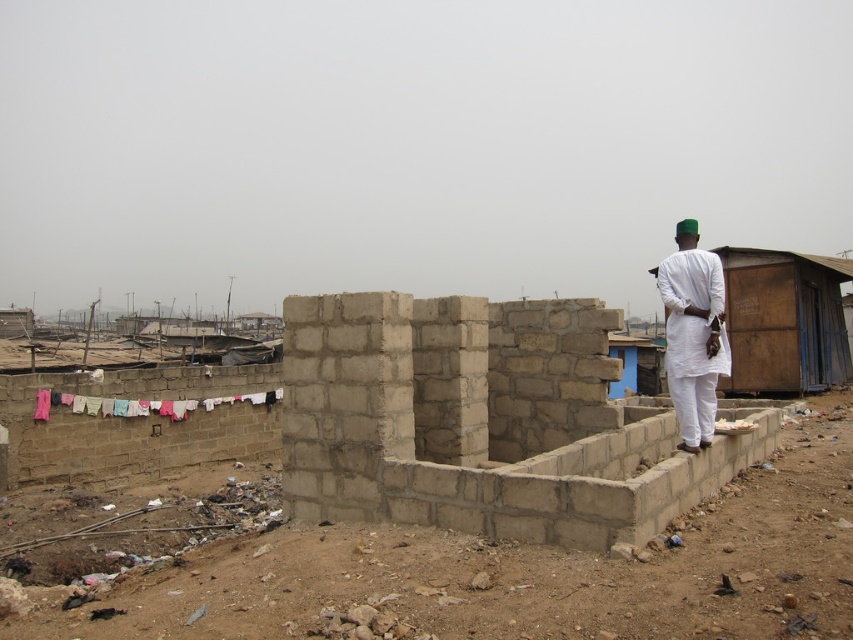
Is wooden hut at right thinner than white cotton shirt at right?

No, wooden hut at right is not thinner than white cotton shirt at right.

Can you confirm if wooden hut at right is positioned above white cotton shirt at right?

Yes, wooden hut at right is above white cotton shirt at right.

Locate an element on the screen. Image resolution: width=853 pixels, height=640 pixels. wooden hut at right is located at coordinates (784, 321).

Can you confirm if white cotton shirt at right is taller than multicolored fabric at left?

Correct, white cotton shirt at right is much taller as multicolored fabric at left.

Who is more forward, (703, 280) or (142, 403)?

Point (703, 280) is more forward.

Locate an element on the screen. white cotton shirt at right is located at coordinates (693, 333).

The height and width of the screenshot is (640, 853). In order to click on white cotton shirt at right in this screenshot , I will do `click(693, 333)`.

Is point (795, 312) positioned before point (163, 403)?

Yes.

Is wooden hut at right further to the viewer compared to multicolored fabric at left?

No, it is in front of multicolored fabric at left.

Between point (766, 388) and point (155, 410), which one is positioned in front?

Point (155, 410) is in front.

Where is `wooden hut at right`? The image size is (853, 640). wooden hut at right is located at coordinates pos(784,321).